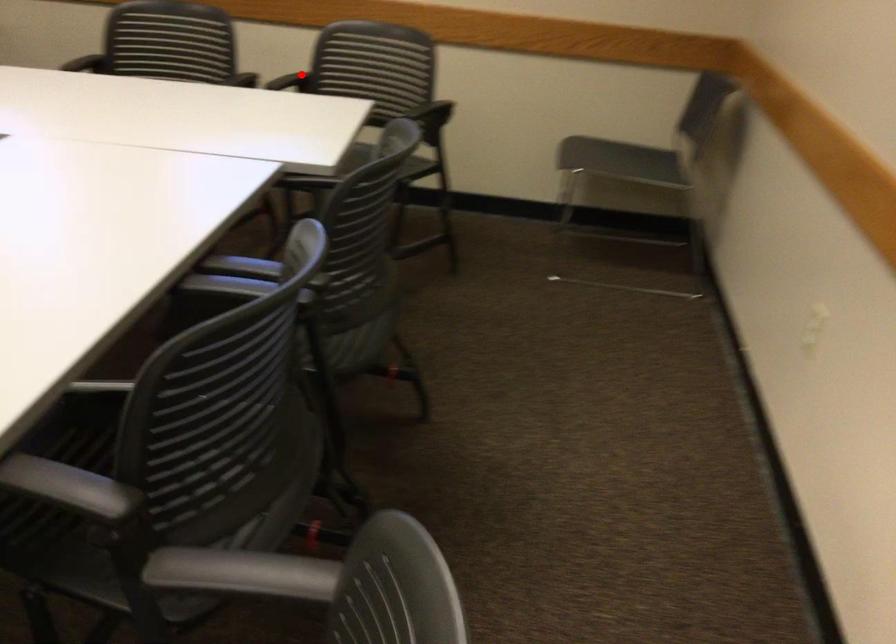
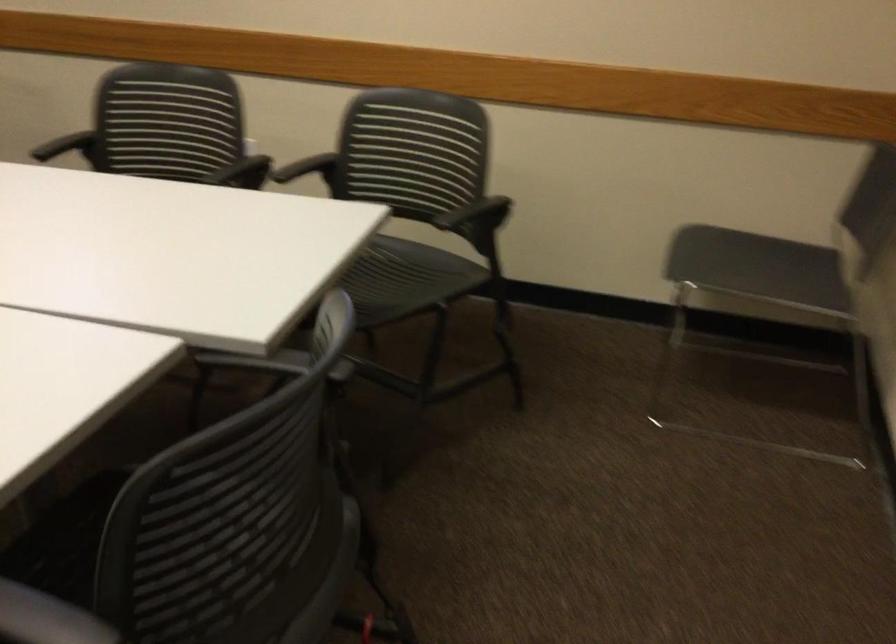
Question: I am providing you with two images of the same scene from different viewpoints. A red point is marked on the first image. Is the red point's position out of view in image 2?

Choices:
 (A) Yes
 (B) No

Answer: (A)